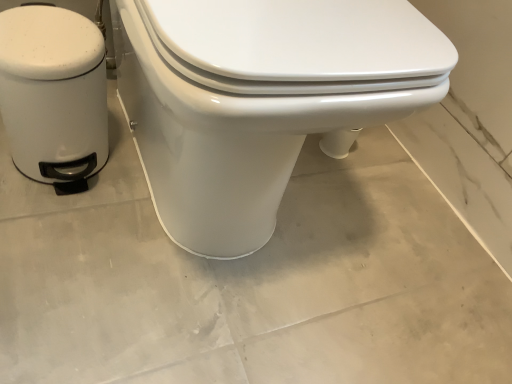
Question: Is white matte trash can at left further to camera compared to white glossy toilet at center?

Choices:
 (A) no
 (B) yes

Answer: (B)

Question: Does white matte trash can at left touch white glossy toilet at center?

Choices:
 (A) yes
 (B) no

Answer: (B)

Question: Is white matte trash can at left positioned far away from white glossy toilet at center?

Choices:
 (A) no
 (B) yes

Answer: (A)

Question: From a real-world perspective, is white matte trash can at left on white glossy toilet at center?

Choices:
 (A) no
 (B) yes

Answer: (A)

Question: Does white matte trash can at left contain white glossy toilet at center?

Choices:
 (A) yes
 (B) no

Answer: (B)

Question: From a real-world perspective, is white matte trash can at left below white glossy toilet at center?

Choices:
 (A) no
 (B) yes

Answer: (B)

Question: Can you confirm if white glossy toilet at center is positioned to the left of white matte trash can at left?

Choices:
 (A) no
 (B) yes

Answer: (A)

Question: Is white glossy toilet at center placed right next to white matte trash can at left?

Choices:
 (A) yes
 (B) no

Answer: (B)

Question: From the image's perspective, would you say white glossy toilet at center is positioned over white matte trash can at left?

Choices:
 (A) yes
 (B) no

Answer: (A)

Question: Could you tell me if white glossy toilet at center is facing white matte trash can at left?

Choices:
 (A) no
 (B) yes

Answer: (A)

Question: Would you say white glossy toilet at center is outside white matte trash can at left?

Choices:
 (A) yes
 (B) no

Answer: (A)

Question: Is white glossy toilet at center shorter than white matte trash can at left?

Choices:
 (A) no
 (B) yes

Answer: (A)

Question: Considering the positions of white matte trash can at left and white glossy toilet at center in the image, is white matte trash can at left wider or thinner than white glossy toilet at center?

Choices:
 (A) thin
 (B) wide

Answer: (A)